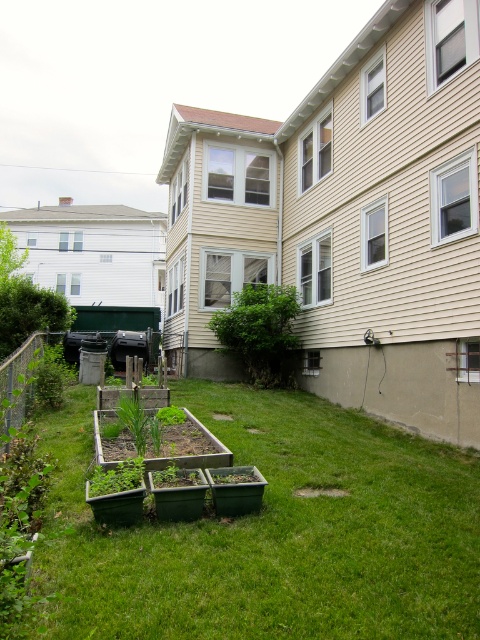
Question: Which object is closer to the camera taking this photo?

Choices:
 (A) green grass at lower center
 (B) green leafy bush at center
 (C) green matte planter at lower left

Answer: (C)

Question: From the image, what is the correct spatial relationship of green leafy bush at center in relation to green matte planter at lower left?

Choices:
 (A) left
 (B) right

Answer: (B)

Question: Which point is farther from the camera taking this photo?

Choices:
 (A) (219, 429)
 (B) (244, 308)

Answer: (B)

Question: Where is green leafy bush at center located in relation to green matte planter at lower left in the image?

Choices:
 (A) left
 (B) right

Answer: (B)

Question: Which point is farther to the camera?

Choices:
 (A) (263, 520)
 (B) (188, 445)
 (C) (131, 481)

Answer: (B)

Question: Observing the image, what is the correct spatial positioning of green wooden raised beds at center in reference to green leafy bush at center?

Choices:
 (A) above
 (B) below

Answer: (B)